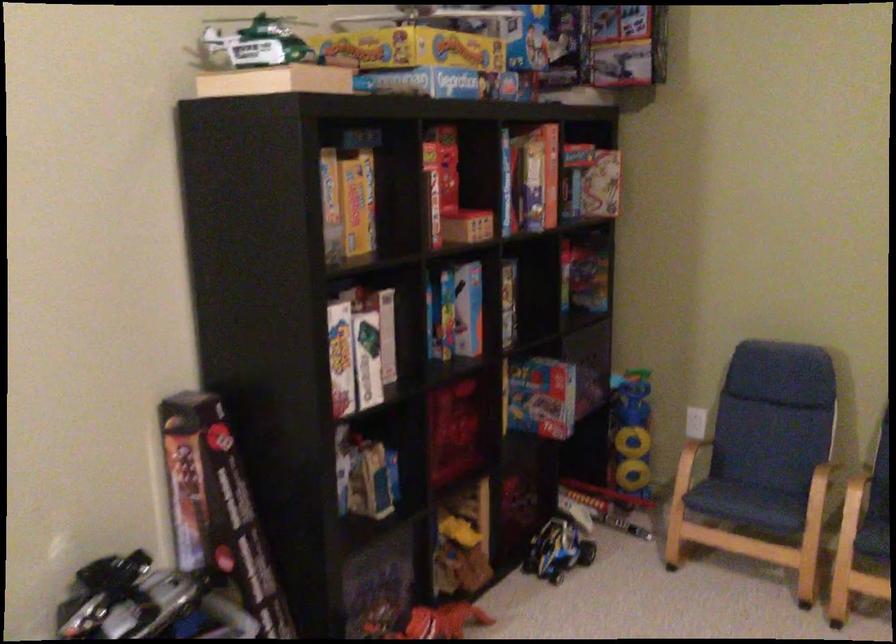
Where is `yellow game box`? The image size is (896, 644). yellow game box is located at coordinates (414, 49).